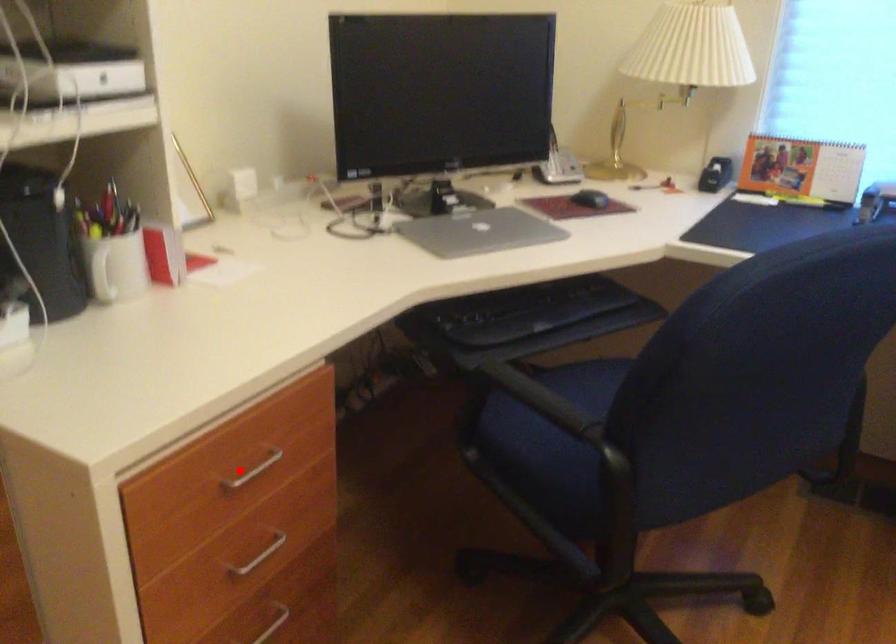
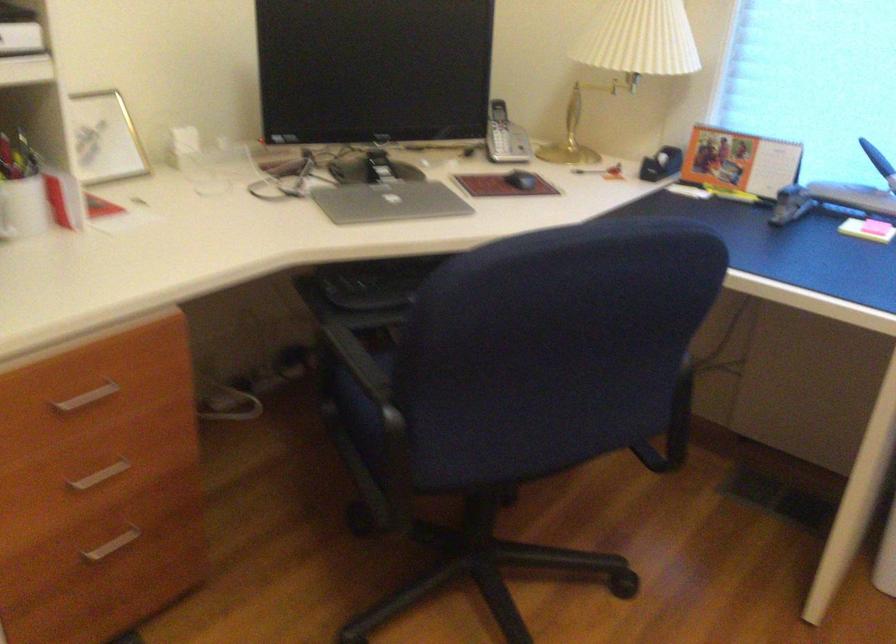
The point at the highlighted location is marked in the first image. Where is the corresponding point in the second image?

(87, 397)